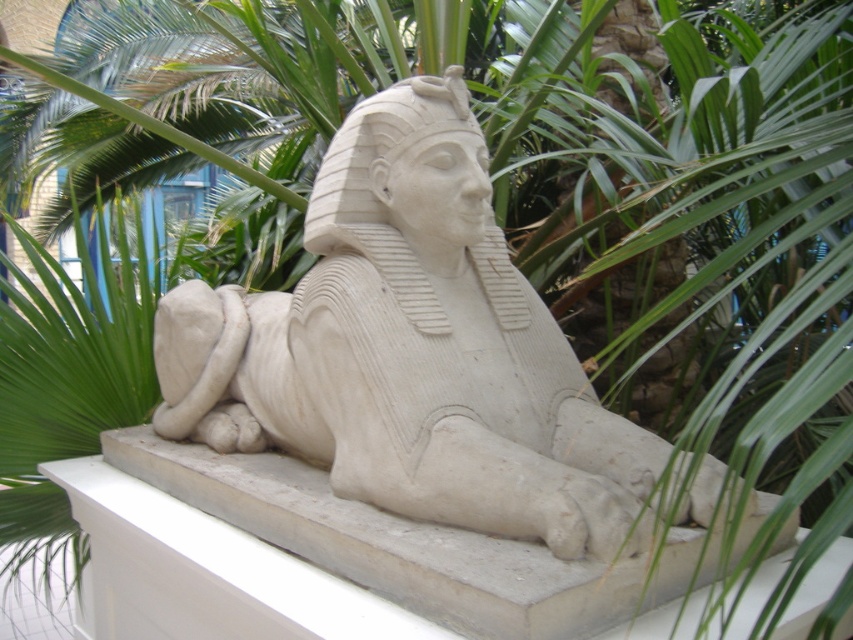
Is white stone sphinx at center shorter than white stone ledge at center?

Incorrect, white stone sphinx at center's height does not fall short of white stone ledge at center's.

Between point (640, 468) and point (451, 586), which one is positioned behind?

The point (640, 468) is behind.

Does point (244, 420) lie in front of point (664, 557)?

No, it is behind (664, 557).

The width and height of the screenshot is (853, 640). I want to click on white stone sphinx at center, so click(410, 348).